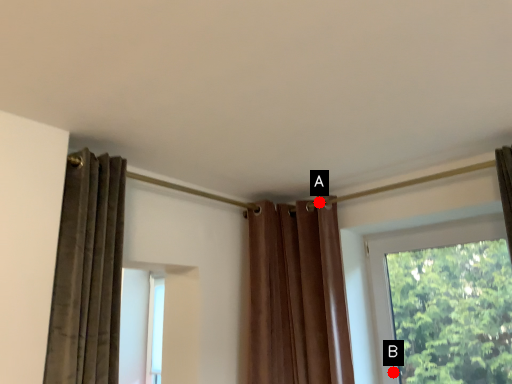
Question: Two points are circled on the image, labeled by A and B beside each circle. Which point is farther to the camera?

Choices:
 (A) A is further
 (B) B is further

Answer: (A)